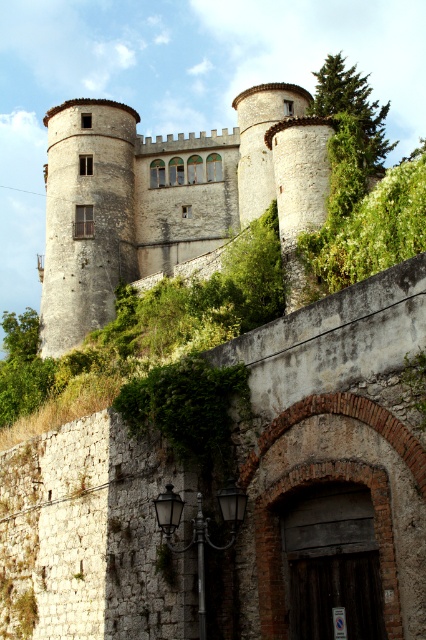
You are a tourist standing at the base of the hill looking up at the white stone castle at center and the green leafy bush at upper right. Which object appears closer to you from your vantage point?

The white stone castle at center appears closer because the green leafy bush at upper right is positioned behind it, making the castle the nearer object from your viewpoint.

You are standing at the base of the hill looking up at the historic stone structure. You notice a white stone castle at center and a green leafy bush at upper right. Which object is positioned more to the left side of your view?

The white stone castle at center is positioned to the left of the green leafy bush at upper right, so it is more to the left side of your view.

You are standing at the base of the hill where the white stone castle at center is located. If you want to take a photo of the castle from your current position, will the entire castle fit in your camera frame? Assume your camera has a standard 50mm lens and you are using a full frame sensor. The castle is 120 feet tall and 80 feet wide.

The white stone castle at center is 223.82 feet away from the camera. Using a 50mm lens on a full frame sensor, the horizontal field of view is approximately 30 feet at that distance. Since the castle is 80 feet wide, it is wider than the camera frame. Therefore, the entire castle will not fit in the frame.